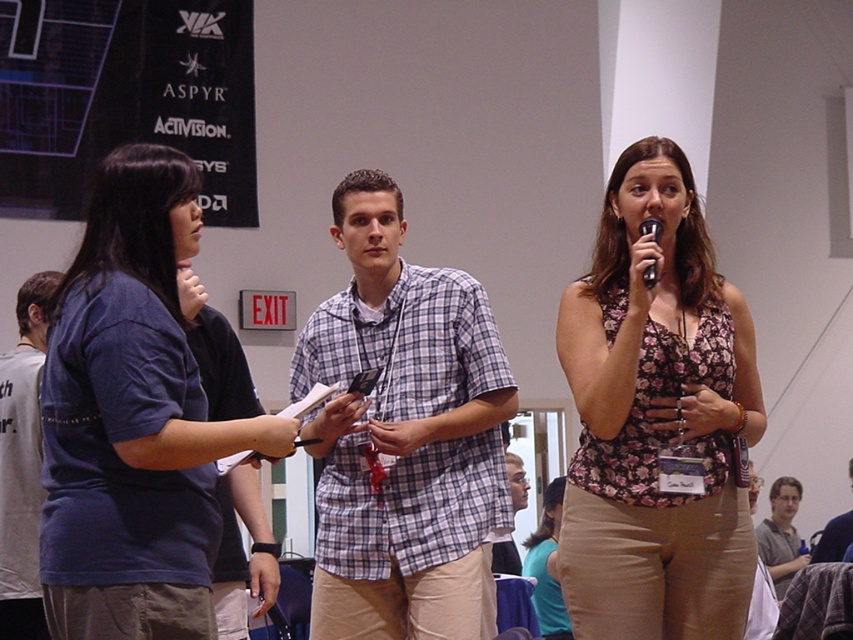
Between floral fabric top at center and matte blue shirt at left, which one has less height?

matte blue shirt at left

Locate an element on the screen. floral fabric top at center is located at coordinates (656, 419).

Can you confirm if white cotton shirt at left is positioned to the left of gray fabric shirt at lower right?

Correct, you'll find white cotton shirt at left to the left of gray fabric shirt at lower right.

Does white cotton shirt at left have a greater height compared to gray fabric shirt at lower right?

Indeed, white cotton shirt at left has a greater height compared to gray fabric shirt at lower right.

Between point (4, 458) and point (770, 502), which one is positioned in front?

Point (4, 458) is more forward.

Where is `white cotton shirt at left`? white cotton shirt at left is located at coordinates (22, 465).

Who is more distant from viewer, (184, 225) or (648, 264)?

Point (648, 264)

Where is `matte blue shirt at left`? This screenshot has width=853, height=640. matte blue shirt at left is located at coordinates (132, 419).

Based on the photo, measure the distance between matte blue shirt at left and camera.

The distance of matte blue shirt at left from camera is 8.28 feet.

Locate an element on the screen. This screenshot has height=640, width=853. matte blue shirt at left is located at coordinates (132, 419).